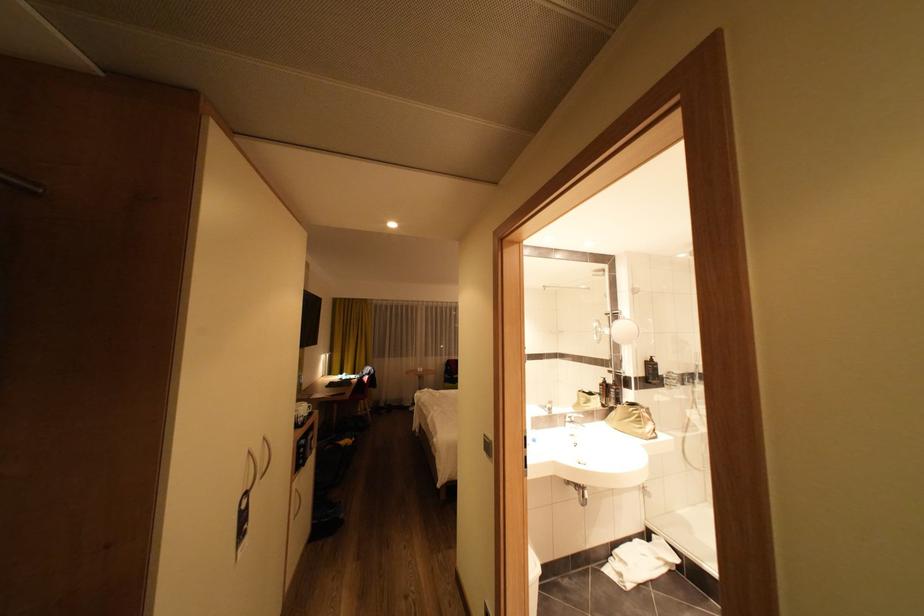
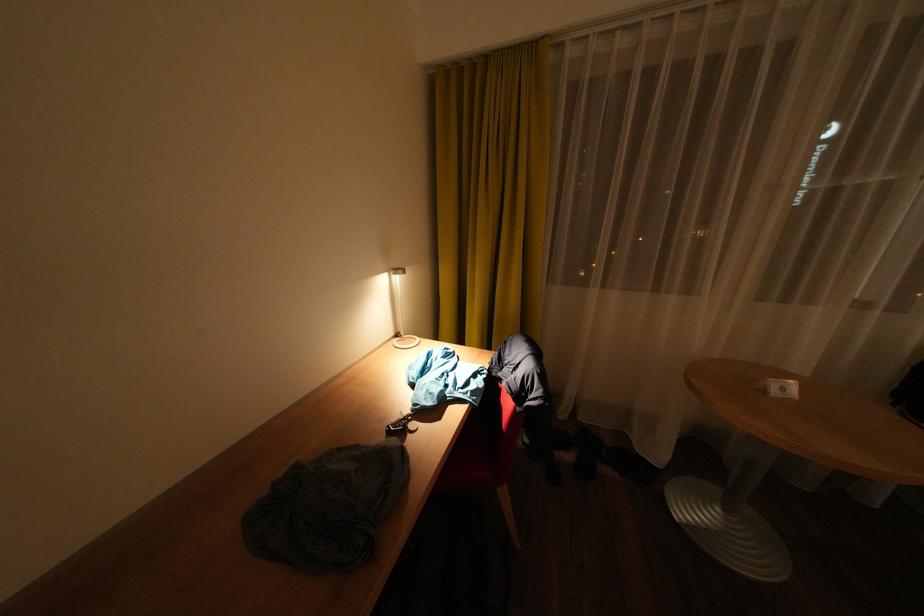
In the second image, find the point that corresponds to point (334, 377) in the first image.

(407, 336)